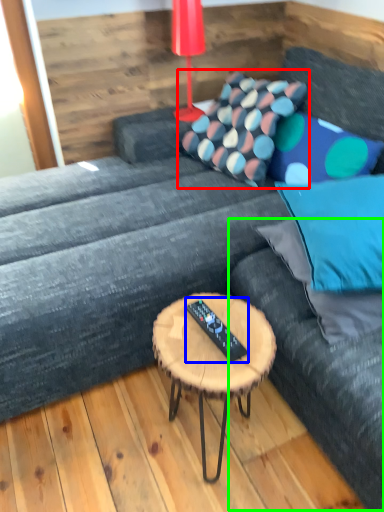
Question: Which object is positioned farthest from pillow (highlighted by a red box)? Select from remote (highlighted by a blue box) and bean bag chair (highlighted by a green box).

Choices:
 (A) remote
 (B) bean bag chair

Answer: (A)